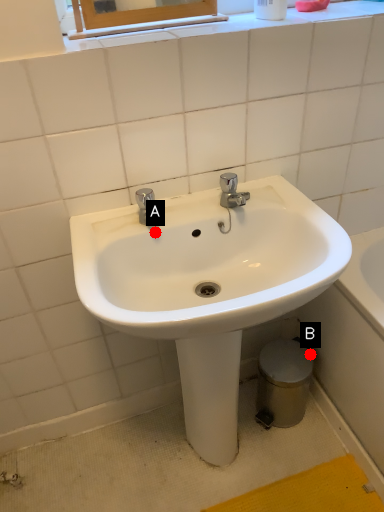
Question: Two points are circled on the image, labeled by A and B beside each circle. Which point is closer to the camera taking this photo?

Choices:
 (A) A is closer
 (B) B is closer

Answer: (A)